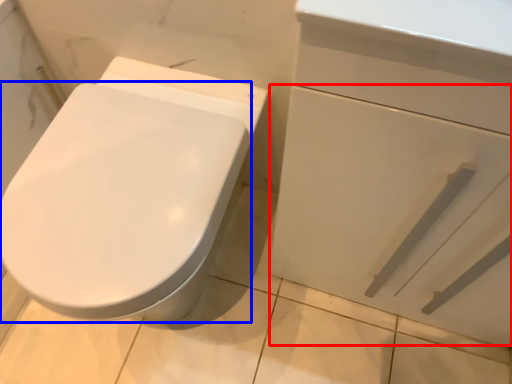
Question: Which point is closer to the camera, drawer (highlighted by a red box) or bidet (highlighted by a blue box)?

Choices:
 (A) drawer
 (B) bidet

Answer: (A)